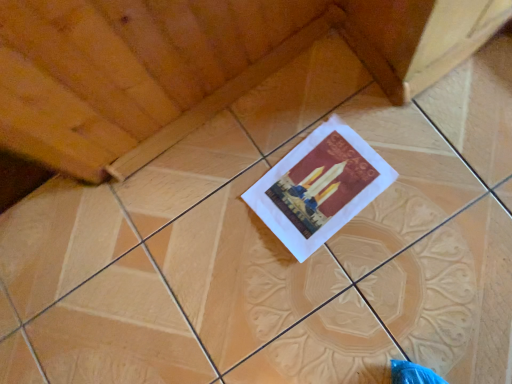
You are a GUI agent. You are given a task and a screenshot of the screen. Output one action in this format:
    pyautogui.click(x=<x>, y=<y>)
    Task: Click on the matte paper postcard at center
    The height and width of the screenshot is (384, 512).
    Given the screenshot: What is the action you would take?
    pyautogui.click(x=319, y=187)

Measure the distance between point (x=359, y=177) and camera.

The depth of point (x=359, y=177) is 37.76 inches.

The width and height of the screenshot is (512, 384). What do you see at coordinates (319, 187) in the screenshot? I see `matte paper postcard at center` at bounding box center [319, 187].

This screenshot has height=384, width=512. Find the location of `matte paper postcard at center`. matte paper postcard at center is located at coordinates (319, 187).